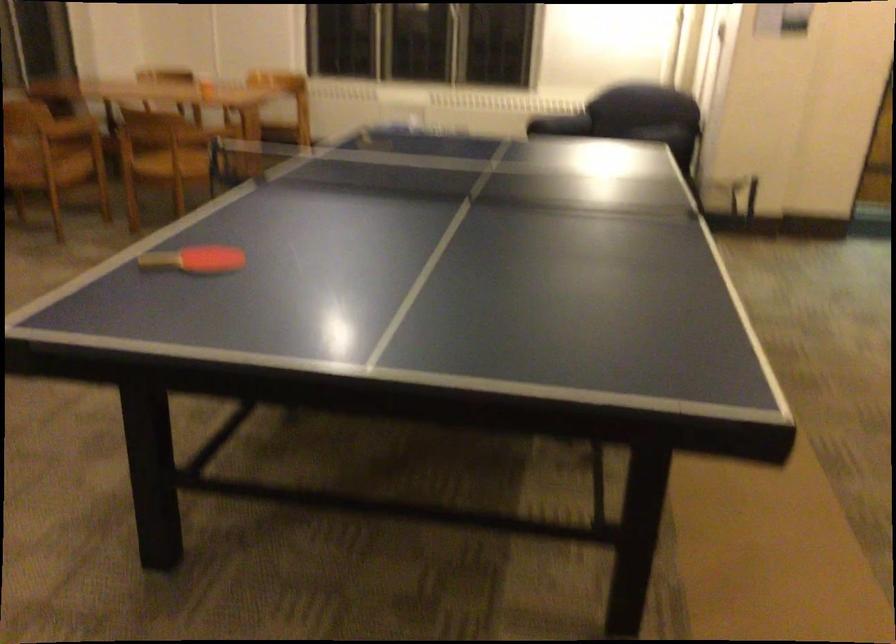
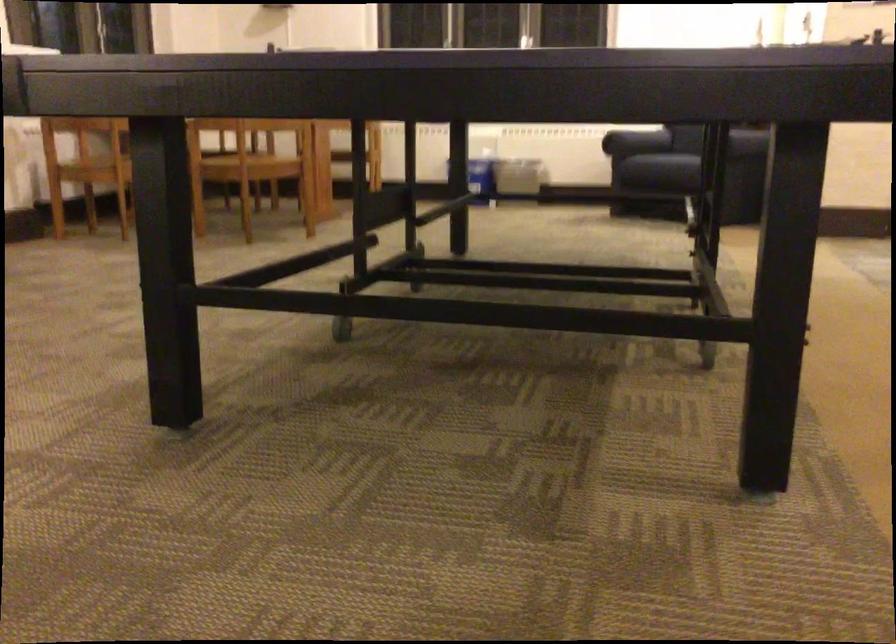
Question: The first image is from the beginning of the video and the second image is from the end. How did the camera likely rotate when shooting the video?

Choices:
 (A) Left
 (B) Right
 (C) Up
 (D) Down

Answer: (C)